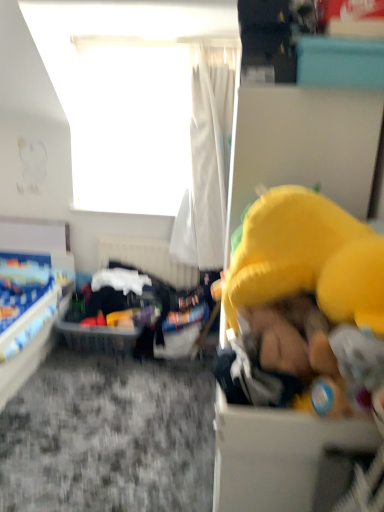
Find the location of a particular element. Image resolution: width=384 pixels, height=512 pixels. free point above transparent plastic window screen at upper center (from a real-world perspective) is located at coordinates (147, 41).